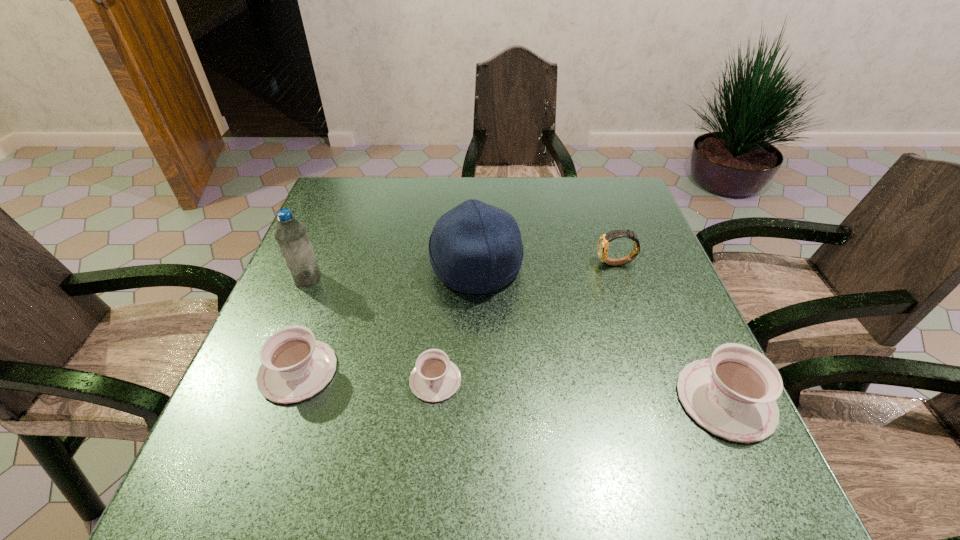
In the image, there is a desktop. Identify the location of free space at the far left corner. (378, 179).

You are a GUI agent. You are given a task and a screenshot of the screen. Output one action in this format:
    pyautogui.click(x=<x>, y=<y>)
    Task: Click on the free location at the far right corner of the desktop
    This screenshot has width=960, height=540.
    Given the screenshot: What is the action you would take?
    pyautogui.click(x=631, y=200)

This screenshot has width=960, height=540. In order to click on free space between the second teacup from left to right and the rightmost teacup in this screenshot , I will do pos(581,390).

Locate an element on the screen. This screenshot has width=960, height=540. free spot between the watch and the skullcap is located at coordinates (546, 265).

Image resolution: width=960 pixels, height=540 pixels. Identify the location of vacant point located between the shortest object and the watch. (526, 322).

Find the location of a particular element. This screenshot has width=960, height=540. vacant area between the second shortest teacup and the watch is located at coordinates (457, 318).

The height and width of the screenshot is (540, 960). What are the coordinates of `vacant space in between the water bottle and the skullcap` in the screenshot? It's located at (392, 273).

Locate an element on the screen. vacant region between the second teacup from right to left and the rightmost teacup is located at coordinates (581, 390).

The height and width of the screenshot is (540, 960). I want to click on free space between the water bottle and the second shortest object, so click(x=302, y=325).

Find the location of `vacant space in between the shortest object and the watch`. vacant space in between the shortest object and the watch is located at coordinates (526, 322).